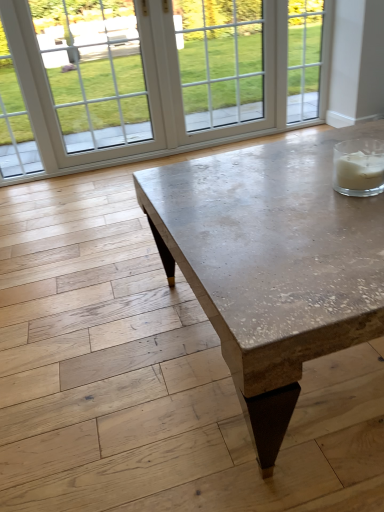
Question: Considering the relative sizes of white glass window at upper left and matte concrete coffee table at center in the image provided, is white glass window at upper left thinner than matte concrete coffee table at center?

Choices:
 (A) yes
 (B) no

Answer: (A)

Question: From a real-world perspective, is white glass window at upper left physically below matte concrete coffee table at center?

Choices:
 (A) yes
 (B) no

Answer: (B)

Question: Is white glass window at upper left oriented towards matte concrete coffee table at center?

Choices:
 (A) yes
 (B) no

Answer: (B)

Question: Considering the relative positions of white glass window at upper left and matte concrete coffee table at center in the image provided, is white glass window at upper left to the left of matte concrete coffee table at center from the viewer's perspective?

Choices:
 (A) no
 (B) yes

Answer: (B)

Question: Considering the relative sizes of white glass window at upper left and matte concrete coffee table at center in the image provided, is white glass window at upper left bigger than matte concrete coffee table at center?

Choices:
 (A) yes
 (B) no

Answer: (B)

Question: Can you confirm if white glass window at upper left is wider than matte concrete coffee table at center?

Choices:
 (A) yes
 (B) no

Answer: (B)

Question: Considering the relative sizes of matte concrete coffee table at center and white glass window at upper left in the image provided, is matte concrete coffee table at center shorter than white glass window at upper left?

Choices:
 (A) no
 (B) yes

Answer: (B)

Question: Is white glass window at upper left at the back of matte concrete coffee table at center?

Choices:
 (A) yes
 (B) no

Answer: (A)

Question: Is matte concrete coffee table at center bigger than white glass window at upper left?

Choices:
 (A) no
 (B) yes

Answer: (B)

Question: Is matte concrete coffee table at center wider than white glass window at upper left?

Choices:
 (A) no
 (B) yes

Answer: (B)

Question: From a real-world perspective, does matte concrete coffee table at center stand above white glass window at upper left?

Choices:
 (A) no
 (B) yes

Answer: (A)

Question: Is the surface of matte concrete coffee table at center in direct contact with white glass window at upper left?

Choices:
 (A) no
 (B) yes

Answer: (A)

Question: Relative to matte concrete coffee table at center, is white glass window at upper left in front or behind?

Choices:
 (A) front
 (B) behind

Answer: (B)